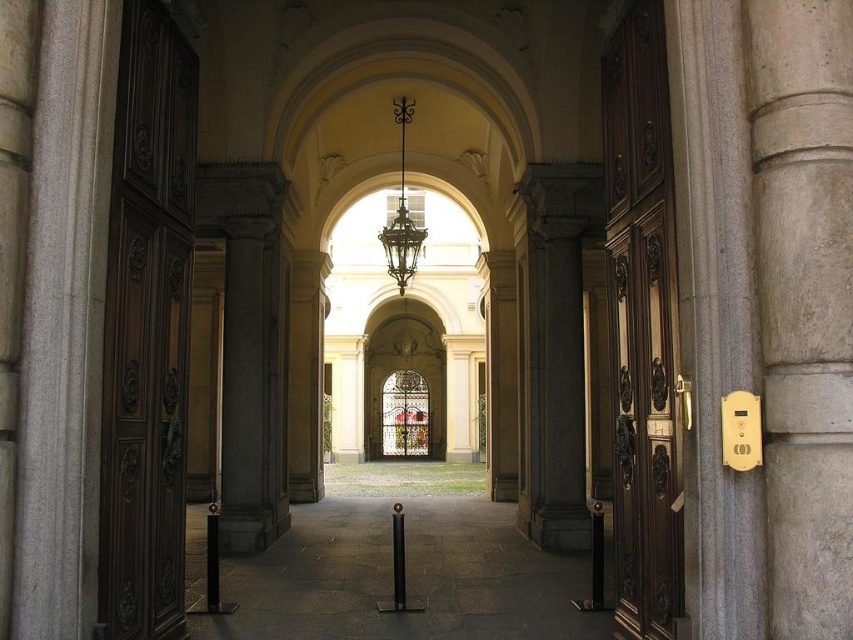
Question: Can you confirm if dark wood door at left is positioned below polished dark wood door at right?

Choices:
 (A) no
 (B) yes

Answer: (B)

Question: Which point is farther to the camera?

Choices:
 (A) metallic wrought iron chandelier at center
 (B) dark wood door at left

Answer: (A)

Question: Which object is closer to the camera taking this photo?

Choices:
 (A) polished dark wood door at right
 (B) dark wood door at left

Answer: (B)

Question: Which point appears farthest from the camera in this image?

Choices:
 (A) (144, 561)
 (B) (643, 97)
 (C) (396, 227)

Answer: (C)

Question: Is dark wood door at left above metallic wrought iron chandelier at center?

Choices:
 (A) no
 (B) yes

Answer: (A)

Question: Where is dark wood door at left located in relation to metallic wrought iron chandelier at center in the image?

Choices:
 (A) below
 (B) above

Answer: (A)